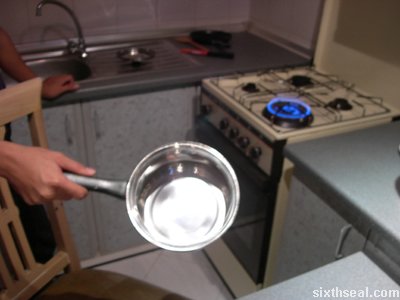
The width and height of the screenshot is (400, 300). I want to click on stove knobs, so click(205, 109), click(225, 125), click(232, 130), click(243, 142), click(255, 151).